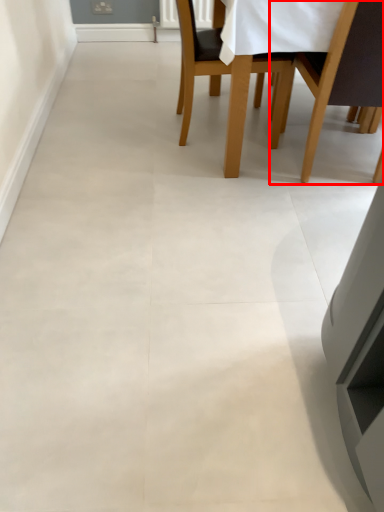
Question: Observing the image, what is the correct spatial positioning of chair (annotated by the red box) in reference to chair?

Choices:
 (A) left
 (B) right

Answer: (B)